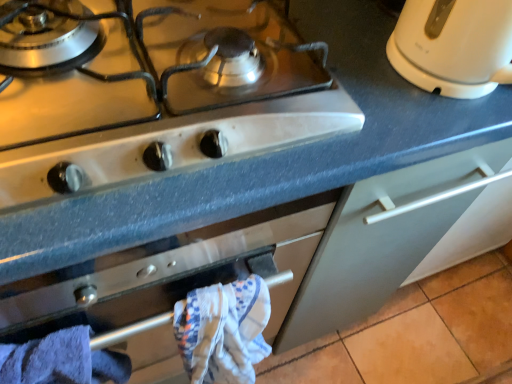
Question: Is white glossy electric kettle at upper right positioned in front of white glossy gas stove at upper left?

Choices:
 (A) no
 (B) yes

Answer: (A)

Question: Is white glossy electric kettle at upper right further to the viewer compared to white glossy gas stove at upper left?

Choices:
 (A) no
 (B) yes

Answer: (B)

Question: Is white glossy electric kettle at upper right not within white glossy gas stove at upper left?

Choices:
 (A) no
 (B) yes

Answer: (B)

Question: Could you tell me if white glossy electric kettle at upper right is turned towards white glossy gas stove at upper left?

Choices:
 (A) no
 (B) yes

Answer: (A)

Question: From the image's perspective, is white glossy electric kettle at upper right beneath white glossy gas stove at upper left?

Choices:
 (A) no
 (B) yes

Answer: (A)

Question: From a real-world perspective, is white glossy electric kettle at upper right beneath white glossy gas stove at upper left?

Choices:
 (A) yes
 (B) no

Answer: (B)

Question: From a real-world perspective, is white textured bath towel at center, which is the first bath towel in right-to-left order, located higher than white glossy electric kettle at upper right?

Choices:
 (A) yes
 (B) no

Answer: (B)

Question: Does white textured bath towel at center, which is the first bath towel in right-to-left order, lie behind white glossy electric kettle at upper right?

Choices:
 (A) yes
 (B) no

Answer: (A)

Question: From the image's perspective, does white textured bath towel at center, arranged as the 2th bath towel when viewed from the left, appear higher than white glossy electric kettle at upper right?

Choices:
 (A) yes
 (B) no

Answer: (B)

Question: From the image's perspective, is white textured bath towel at center, which is the first bath towel in right-to-left order, below white glossy electric kettle at upper right?

Choices:
 (A) no
 (B) yes

Answer: (B)

Question: Does white textured bath towel at center, arranged as the 2th bath towel when viewed from the left, lie in front of white glossy electric kettle at upper right?

Choices:
 (A) yes
 (B) no

Answer: (B)

Question: Considering the relative positions of white textured bath towel at center, arranged as the 2th bath towel when viewed from the left, and white glossy electric kettle at upper right in the image provided, is white textured bath towel at center, arranged as the 2th bath towel when viewed from the left, to the left of white glossy electric kettle at upper right from the viewer's perspective?

Choices:
 (A) no
 (B) yes

Answer: (B)

Question: Considering the relative positions of white glossy gas stove at upper left and blue cotton bath towel at lower left, placed as the first bath towel when sorted from left to right, in the image provided, is white glossy gas stove at upper left to the right of blue cotton bath towel at lower left, placed as the first bath towel when sorted from left to right, from the viewer's perspective?

Choices:
 (A) yes
 (B) no

Answer: (A)